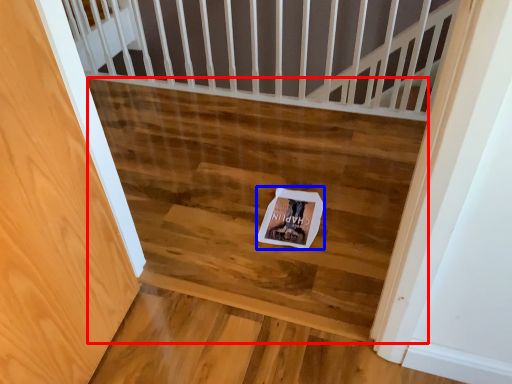
Question: Which object appears farthest to the camera in this image, stairwell (highlighted by a red box) or postcard (highlighted by a blue box)?

Choices:
 (A) stairwell
 (B) postcard

Answer: (B)